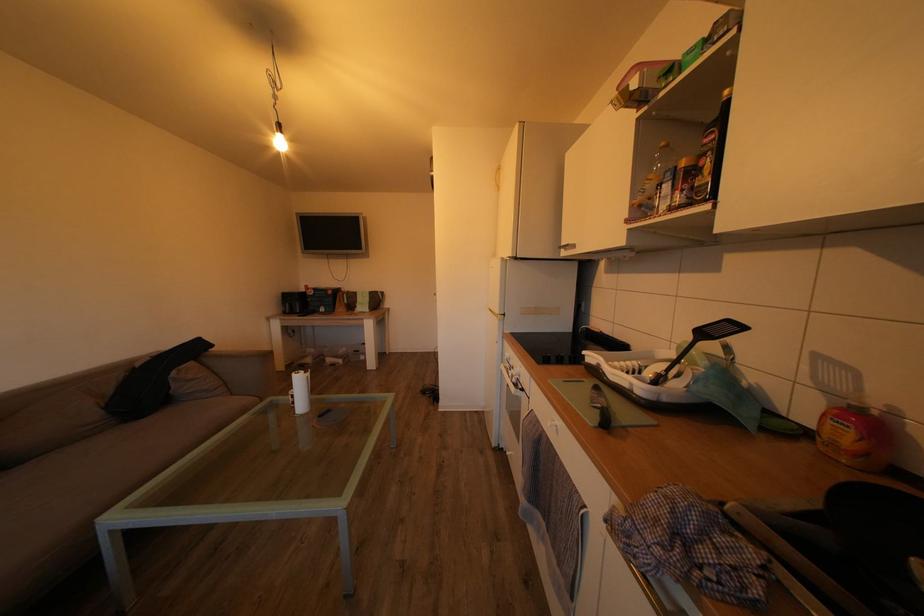
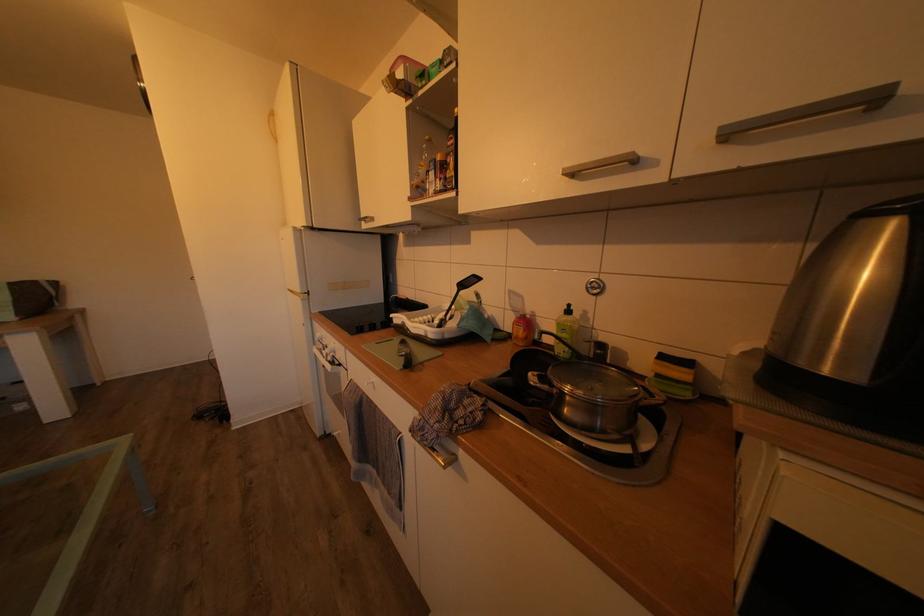
Where in the second image is the point corresponding to the point at 812,439 from the first image?

(517, 342)